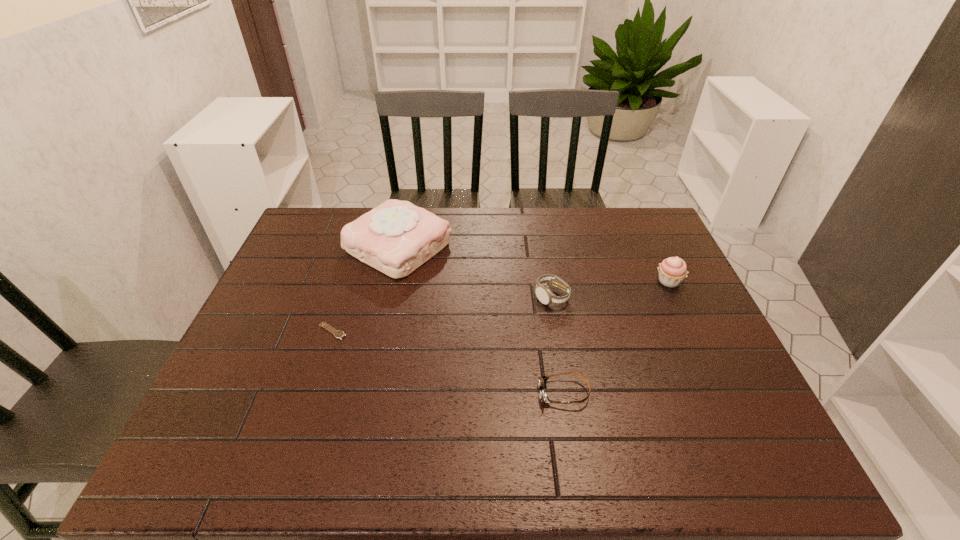
Where is `vacant area between the nearest object and the cupcake`? This screenshot has height=540, width=960. vacant area between the nearest object and the cupcake is located at coordinates (616, 337).

Find the location of a particular element. This screenshot has height=540, width=960. free spot between the rightmost object and the nearest object is located at coordinates (616, 337).

The image size is (960, 540). What are the coordinates of `empty space that is in between the left watch and the tallest object` in the screenshot? It's located at (366, 289).

Where is `object that is the second closest one to the fourth shortest object`? This screenshot has width=960, height=540. object that is the second closest one to the fourth shortest object is located at coordinates (542, 380).

Identify which object is the third closest to the tallest object. Please provide its 2D coordinates. Your answer should be formatted as a tuple, i.e. [(x, y)], where the tuple contains the x and y coordinates of a point satisfying the conditions above.

[(542, 380)]

At what (x,y) coordinates should I click in order to perform the action: click on vacant region that satisfies the following two spatial constraints: 1. on the face of the right watch; 2. on the front-facing side of the second shortest object. Please return your answer as a coordinate pair (x, y). Looking at the image, I should click on (567, 393).

The width and height of the screenshot is (960, 540). What are the coordinates of `free space that satisfies the following two spatial constraints: 1. on the face of the third tallest object; 2. on the front-facing side of the goggles` in the screenshot? It's located at pyautogui.click(x=567, y=393).

Identify the location of vacant space that satisfies the following two spatial constraints: 1. on the face of the farther watch; 2. on the front-facing side of the nearest object. This screenshot has height=540, width=960. (567, 393).